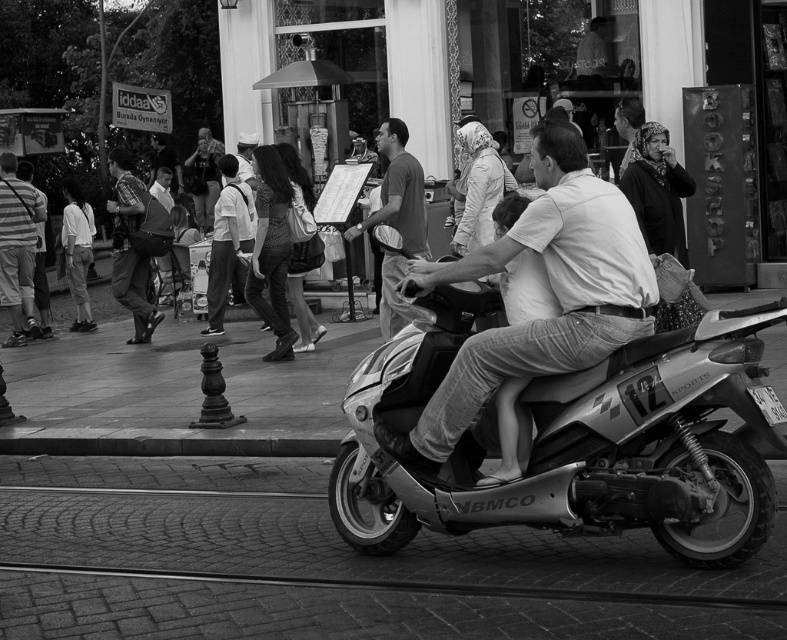
Between matte black headscarf at upper right and white fabric headscarf at center, which one is positioned lower?

Positioned lower is matte black headscarf at upper right.

The height and width of the screenshot is (640, 787). What do you see at coordinates (660, 218) in the screenshot?
I see `matte black headscarf at upper right` at bounding box center [660, 218].

This screenshot has width=787, height=640. I want to click on matte black headscarf at upper right, so click(x=660, y=218).

Does matte silver scooter at center have a lesser height compared to matte gray shirt at center?

Yes.

Who is higher up, matte silver scooter at center or matte gray shirt at center?

matte gray shirt at center

Which is in front, point (451, 392) or point (403, 145)?

Point (451, 392)

At what (x,y) coordinates should I click in order to perform the action: click on matte silver scooter at center. Please return your answer as a coordinate pair (x, y). Looking at the image, I should click on (551, 289).

Is matte black headscarf at upper right further to camera compared to patterned fabric dress at center?

No, matte black headscarf at upper right is in front of patterned fabric dress at center.

How much distance is there between matte black headscarf at upper right and patterned fabric dress at center?

The distance of matte black headscarf at upper right from patterned fabric dress at center is 4.87 meters.

This screenshot has height=640, width=787. In order to click on matte black headscarf at upper right in this screenshot , I will do `click(660, 218)`.